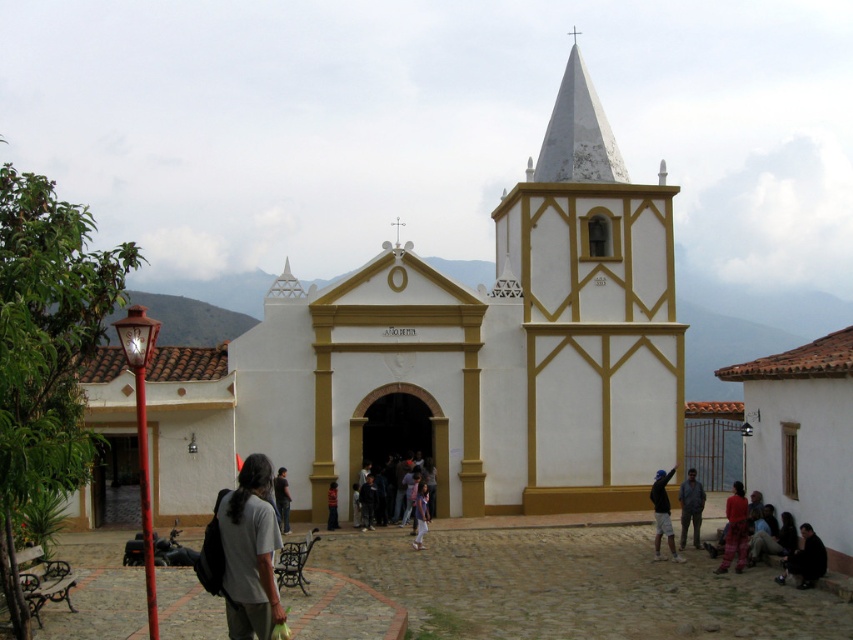
Question: Can you confirm if gray fabric shirt at lower left is positioned to the left of dark brown leather jacket at lower right?

Choices:
 (A) no
 (B) yes

Answer: (B)

Question: Based on their relative distances, which object is farther from the red cotton shirt at lower right?

Choices:
 (A) gray fabric shirt at lower left
 (B) light brown leather shoes at center

Answer: (A)

Question: Which object appears closest to the camera in this image?

Choices:
 (A) dark brown leather jacket at lower right
 (B) blue denim shorts at center
 (C) red cotton shirt at lower right

Answer: (A)

Question: Observing the image, what is the correct spatial positioning of red cotton shirt at lower right in reference to dark gray backpack at center?

Choices:
 (A) left
 (B) right

Answer: (B)

Question: Does dark brown leather jacket at center have a smaller size compared to light brown leather shoes at center?

Choices:
 (A) no
 (B) yes

Answer: (B)

Question: Which point appears closest to the camera in this image?

Choices:
 (A) (601, 444)
 (B) (358, 499)

Answer: (B)